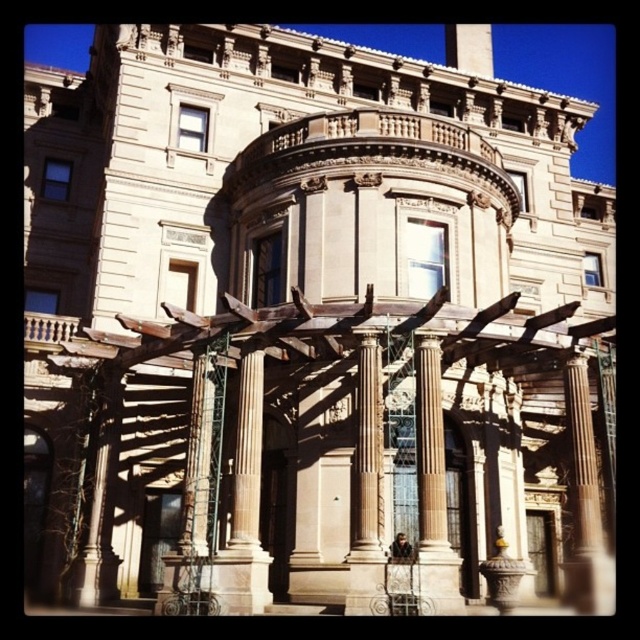
Question: Does sandy brown stone column at center have a smaller size compared to sandy brown stone column at lower left?

Choices:
 (A) no
 (B) yes

Answer: (A)

Question: Which of the following is the closest to the observer?

Choices:
 (A) (106, 488)
 (B) (440, 548)

Answer: (B)

Question: Which point is farther from the camera taking this photo?

Choices:
 (A) (108, 371)
 (B) (445, 560)

Answer: (A)

Question: Can you confirm if sandy brown stone column at center is positioned below sandy brown stone column at lower left?

Choices:
 (A) yes
 (B) no

Answer: (B)

Question: Is the position of sandy brown stone column at center less distant than that of sandy brown stone column at lower left?

Choices:
 (A) yes
 (B) no

Answer: (A)